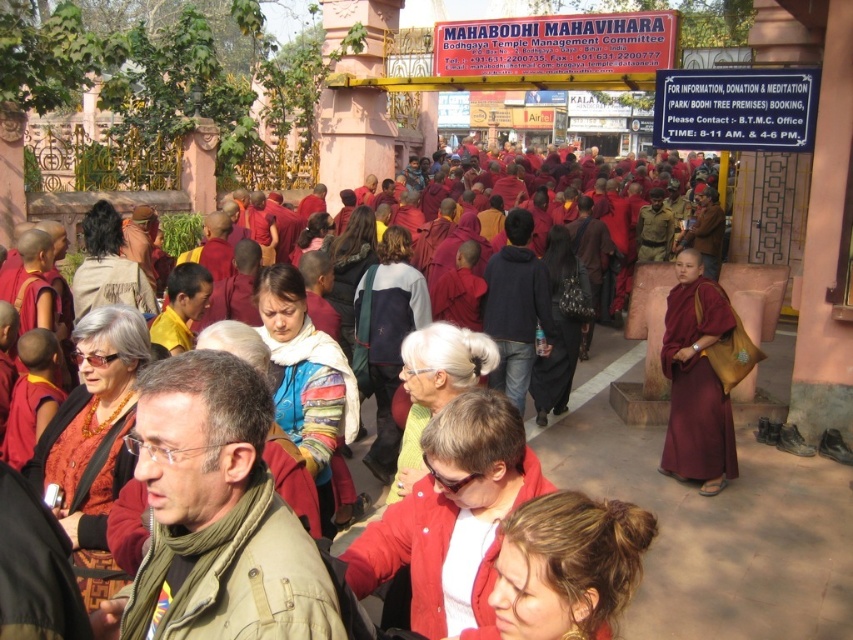
Question: Is brown woolen scarf at center further to camera compared to matte orange robe at center?

Choices:
 (A) no
 (B) yes

Answer: (A)

Question: Which point appears closest to the camera in this image?

Choices:
 (A) (335, 627)
 (B) (399, 538)
 (C) (727, 332)
 (D) (33, 465)

Answer: (A)

Question: Where is brown woolen scarf at center located in relation to matte orange robe at center in the image?

Choices:
 (A) left
 (B) right

Answer: (B)

Question: Which object is positioned closest to the matte orange robe at center?

Choices:
 (A) maroon silk robe at right
 (B) red matte robe at center
 (C) brown woolen scarf at center
 (D) matte maroon robe at center

Answer: (C)

Question: Can you confirm if brown woolen scarf at center is wider than matte maroon robe at center?

Choices:
 (A) yes
 (B) no

Answer: (B)

Question: Which point is farther to the camera?

Choices:
 (A) (718, 394)
 (B) (102, 445)

Answer: (A)